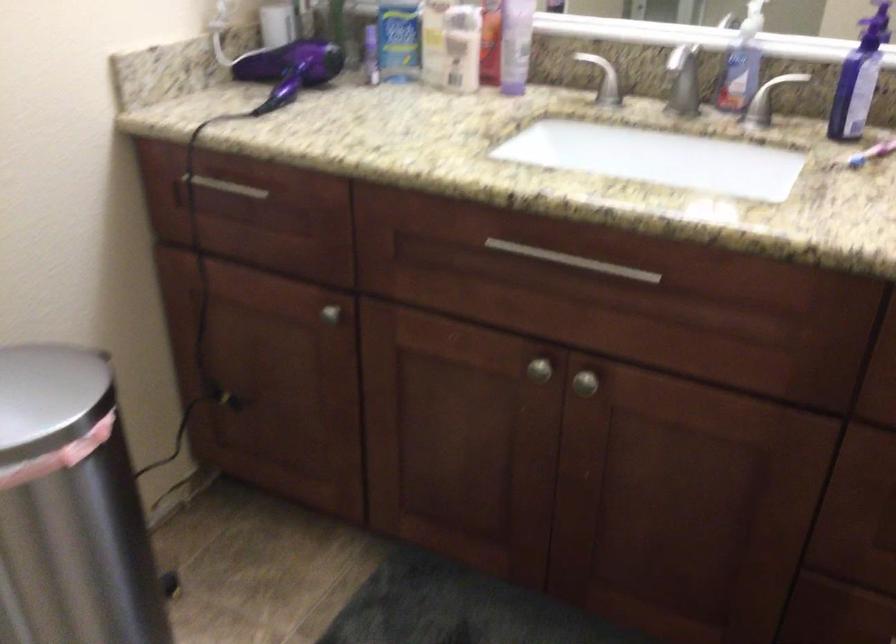
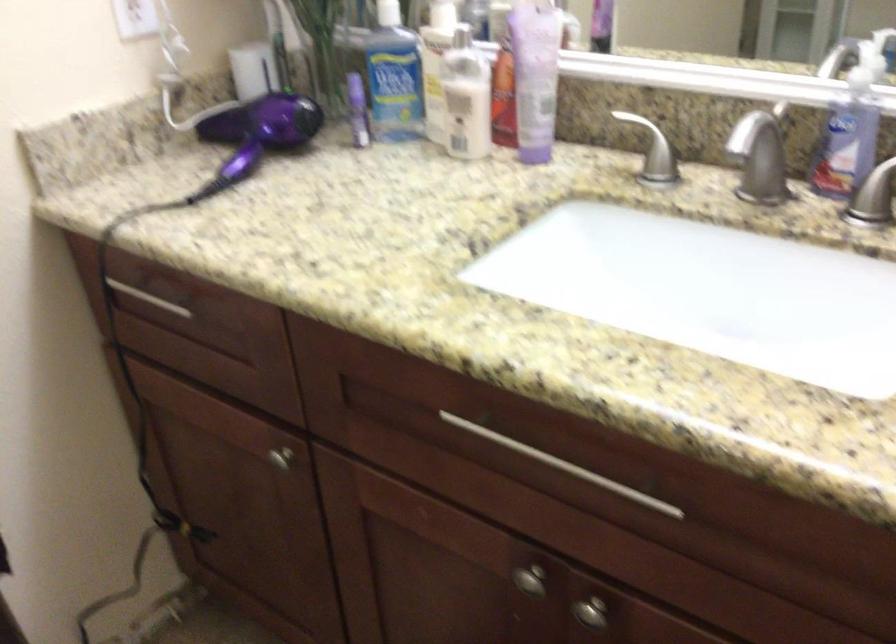
Where in the second image is the point corresponding to (228,189) from the first image?

(149, 298)